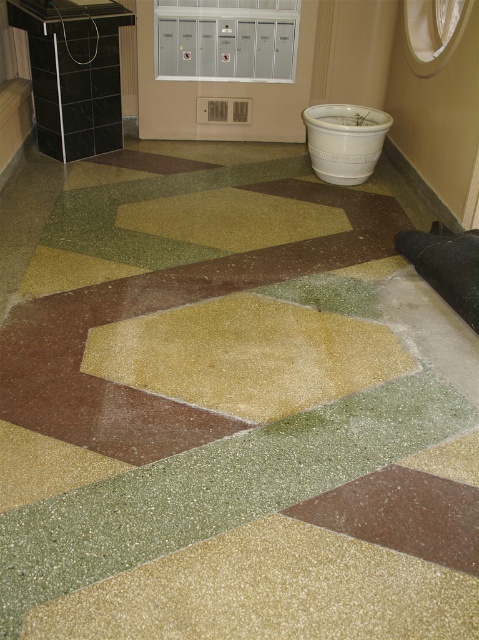
You are a delivery person trying to place a small package on the floor near the brown speckled tile at center and the white ceramic pot at center. Which object is shorter so you can place the package there?

The brown speckled tile at center is not as tall as the white ceramic pot at center, so you should place the package near the brown speckled tile at center since it is shorter.

You are standing on the floor and looking at the shiny gold hexagon at center and the brown speckled tile at center. Which one is higher up?

The shiny gold hexagon at center is above the brown speckled tile at center, so it is higher up.

You are standing on the tiled floor and notice two tiles near your feet. One is the shiny gold hexagon at center and the other is the brown speckled tile at center. Which of these two tiles is bigger?

The shiny gold hexagon at center is larger in size than the brown speckled tile at center.